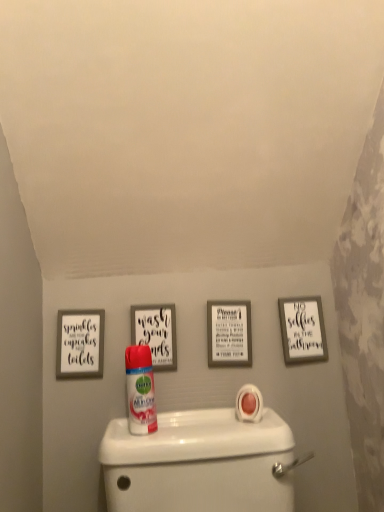
Question: From a real-world perspective, does white matte picture frame at upper right, placed as the 1th picture frame when sorted from right to left, stand above white matte picture frame at center, which is the third picture frame in left-to-right order?

Choices:
 (A) no
 (B) yes

Answer: (A)

Question: Is white matte picture frame at upper right, placed as the 1th picture frame when sorted from right to left, not near white matte picture frame at center, which is the second picture frame from right to left?

Choices:
 (A) yes
 (B) no

Answer: (B)

Question: Is white matte picture frame at upper right, placed as the 1th picture frame when sorted from right to left, further to the viewer compared to white matte picture frame at center, which is the third picture frame in left-to-right order?

Choices:
 (A) yes
 (B) no

Answer: (A)

Question: Can you confirm if white matte picture frame at upper right, acting as the fourth picture frame starting from the left, is bigger than white matte picture frame at center, which is the second picture frame from right to left?

Choices:
 (A) yes
 (B) no

Answer: (B)

Question: Does white matte picture frame at upper right, acting as the fourth picture frame starting from the left, appear on the right side of white matte picture frame at center, which is the second picture frame from right to left?

Choices:
 (A) yes
 (B) no

Answer: (A)

Question: Considering the relative positions of white matte picture frame at upper right, placed as the 1th picture frame when sorted from right to left, and white matte picture frame at center, which is the third picture frame in left-to-right order, in the image provided, is white matte picture frame at upper right, placed as the 1th picture frame when sorted from right to left, in front of white matte picture frame at center, which is the third picture frame in left-to-right order,?

Choices:
 (A) yes
 (B) no

Answer: (B)

Question: Is white matte picture frame at center, which is the second picture frame from right to left, not inside white matte picture frame at upper left, arranged as the 4th picture frame when viewed from the right?

Choices:
 (A) yes
 (B) no

Answer: (A)

Question: Can you confirm if white matte picture frame at center, which is the second picture frame from right to left, is positioned to the left of white matte picture frame at upper left, arranged as the first picture frame when viewed from the left?

Choices:
 (A) no
 (B) yes

Answer: (A)

Question: Is white matte picture frame at center, which is the third picture frame in left-to-right order, positioned with its back to white matte picture frame at upper left, arranged as the first picture frame when viewed from the left?

Choices:
 (A) no
 (B) yes

Answer: (A)

Question: Considering the relative sizes of white matte picture frame at center, which is the third picture frame in left-to-right order, and white matte picture frame at upper left, arranged as the 4th picture frame when viewed from the right, in the image provided, is white matte picture frame at center, which is the third picture frame in left-to-right order, thinner than white matte picture frame at upper left, arranged as the 4th picture frame when viewed from the right,?

Choices:
 (A) no
 (B) yes

Answer: (A)

Question: Considering the relative sizes of white matte picture frame at center, which is the third picture frame in left-to-right order, and white matte picture frame at upper left, arranged as the first picture frame when viewed from the left, in the image provided, is white matte picture frame at center, which is the third picture frame in left-to-right order, wider than white matte picture frame at upper left, arranged as the first picture frame when viewed from the left,?

Choices:
 (A) no
 (B) yes

Answer: (B)

Question: From a real-world perspective, is white matte picture frame at center, which is the second picture frame from right to left, beneath white matte picture frame at upper left, arranged as the first picture frame when viewed from the left?

Choices:
 (A) no
 (B) yes

Answer: (B)

Question: Is matte black picture frame at center, arranged as the 3th picture frame when viewed from the right, behind white matte picture frame at center, which is the third picture frame in left-to-right order?

Choices:
 (A) no
 (B) yes

Answer: (A)